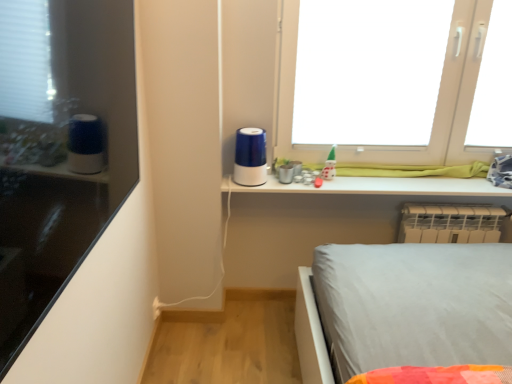
Where is `space that is in front of green glossy toy at upper center`? space that is in front of green glossy toy at upper center is located at coordinates (335, 186).